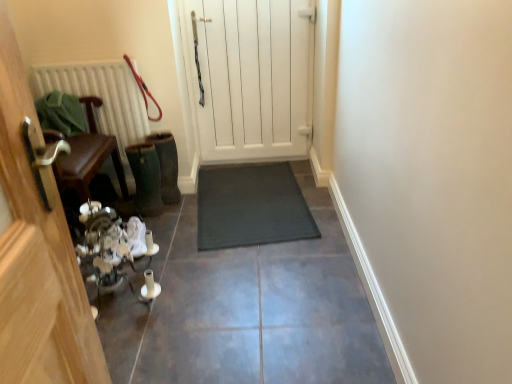
Question: From a real-world perspective, is red leather leash at upper left positioned over wooden chair at left, acting as the first door starting from the front, based on gravity?

Choices:
 (A) yes
 (B) no

Answer: (A)

Question: Does red leather leash at upper left have a greater width compared to wooden chair at left, the second door from the right?

Choices:
 (A) no
 (B) yes

Answer: (A)

Question: Can you confirm if red leather leash at upper left is shorter than wooden chair at left, which is the second door from back to front?

Choices:
 (A) yes
 (B) no

Answer: (A)

Question: Is red leather leash at upper left smaller than wooden chair at left, acting as the first door starting from the front?

Choices:
 (A) no
 (B) yes

Answer: (B)

Question: Considering the relative positions of red leather leash at upper left and wooden chair at left, the second door from the right, in the image provided, is red leather leash at upper left to the right of wooden chair at left, the second door from the right, from the viewer's perspective?

Choices:
 (A) no
 (B) yes

Answer: (B)

Question: In terms of height, does dark gray rubber mat at center look taller or shorter compared to dark gray rubber mat at center?

Choices:
 (A) tall
 (B) short

Answer: (B)

Question: From the image's perspective, is dark gray rubber mat at center located above or below dark gray rubber mat at center?

Choices:
 (A) above
 (B) below

Answer: (B)

Question: From a real-world perspective, is dark gray rubber mat at center physically located above or below dark gray rubber mat at center?

Choices:
 (A) above
 (B) below

Answer: (B)

Question: Is dark gray rubber mat at center spatially inside dark gray rubber mat at center, or outside of it?

Choices:
 (A) outside
 (B) inside

Answer: (A)

Question: From a real-world perspective, is wooden chair at left, which is the first door in left-to-right order, positioned above or below dark gray rubber mat at center?

Choices:
 (A) above
 (B) below

Answer: (A)

Question: Is wooden chair at left, the second door from the right, in front of or behind dark gray rubber mat at center in the image?

Choices:
 (A) behind
 (B) front

Answer: (A)

Question: Do you think wooden chair at left, which is the first door in left-to-right order, is within dark gray rubber mat at center, or outside of it?

Choices:
 (A) inside
 (B) outside

Answer: (B)

Question: Looking at the image, does wooden chair at left, the second door from the right, seem bigger or smaller compared to dark gray rubber mat at center?

Choices:
 (A) small
 (B) big

Answer: (B)

Question: Considering the positions of white wooden door at center, positioned as the first door in back-to-front order, and dark gray rubber mat at center in the image, is white wooden door at center, positioned as the first door in back-to-front order, taller or shorter than dark gray rubber mat at center?

Choices:
 (A) tall
 (B) short

Answer: (A)

Question: In terms of width, does white wooden door at center, positioned as the first door in back-to-front order, look wider or thinner when compared to dark gray rubber mat at center?

Choices:
 (A) wide
 (B) thin

Answer: (B)